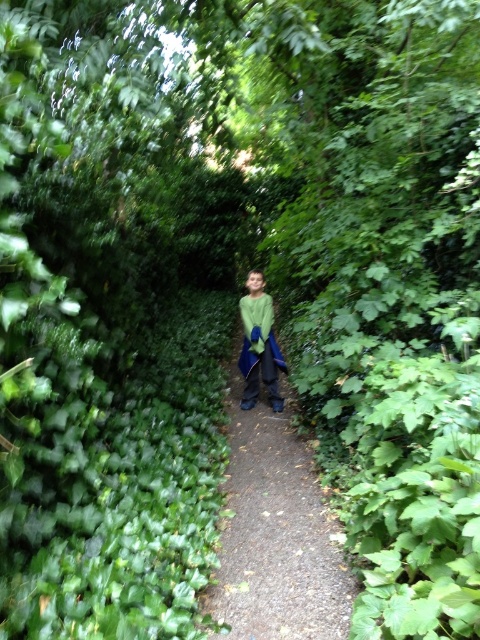
Is smooth dirt path at center wider than green matte jacket at center?

Correct, the width of smooth dirt path at center exceeds that of green matte jacket at center.

Based on the photo, is smooth dirt path at center above green matte jacket at center?

No.

Describe the element at coordinates (276, 532) in the screenshot. The image size is (480, 640). I see `smooth dirt path at center` at that location.

Where is `smooth dirt path at center`? smooth dirt path at center is located at coordinates (276, 532).